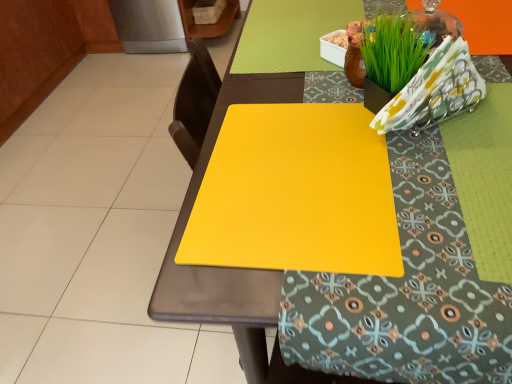
The width and height of the screenshot is (512, 384). Describe the element at coordinates (296, 193) in the screenshot. I see `yellow matte cutting board at center` at that location.

What is the approximate width of yellow matte cutting board at center?

It is 11.36 inches.

The height and width of the screenshot is (384, 512). In order to click on yellow matte cutting board at center in this screenshot , I will do `click(296, 193)`.

Locate an element on the screen. This screenshot has height=384, width=512. yellow matte placemat at center is located at coordinates (233, 268).

In order to face yellow matte placemat at center, should I rotate leftwards or rightwards?

Turn right by 16.352 degrees to look at yellow matte placemat at center.

What do you see at coordinates (233, 268) in the screenshot?
I see `yellow matte placemat at center` at bounding box center [233, 268].

Measure the distance between point (x=258, y=289) and camera.

Point (x=258, y=289) and camera are 19.29 inches apart from each other.

Image resolution: width=512 pixels, height=384 pixels. I want to click on yellow matte cutting board at center, so click(x=296, y=193).

Does yellow matte placemat at center appear on the right side of yellow matte cutting board at center?

Yes.

Which is behind, yellow matte placemat at center or yellow matte cutting board at center?

yellow matte cutting board at center.

Which is in front, point (184, 306) or point (243, 226)?

Point (184, 306)

From the image's perspective, is yellow matte placemat at center positioned above or below yellow matte cutting board at center?

Clearly, from the image's perspective, yellow matte placemat at center is below yellow matte cutting board at center.

From a real-world perspective, between yellow matte placemat at center and yellow matte cutting board at center, who is vertically lower?

In real-world perspective, yellow matte placemat at center is lower.

Which object is wider, yellow matte placemat at center or yellow matte cutting board at center?

yellow matte placemat at center is wider.

Can you confirm if yellow matte placemat at center is taller than yellow matte cutting board at center?

Yes.

Considering the sizes of objects yellow matte placemat at center and yellow matte cutting board at center in the image provided, who is bigger, yellow matte placemat at center or yellow matte cutting board at center?

yellow matte placemat at center.

Based on the photo, can yellow matte cutting board at center be found inside yellow matte placemat at center?

Yes, yellow matte cutting board at center is inside yellow matte placemat at center.

Is yellow matte placemat at center next to yellow matte cutting board at center and touching it?

No, yellow matte placemat at center is not touching yellow matte cutting board at center.

Is yellow matte placemat at center facing away from yellow matte cutting board at center?

yellow matte placemat at center does not have its back to yellow matte cutting board at center.

The height and width of the screenshot is (384, 512). I want to click on table on the right of the yellow matte cutting board at center, so click(233, 268).

Does yellow matte cutting board at center appear on the right side of yellow matte placemat at center?

In fact, yellow matte cutting board at center is to the left of yellow matte placemat at center.

Between yellow matte cutting board at center and yellow matte placemat at center, which one is positioned in front?

yellow matte placemat at center is more forward.

Which is behind, point (244, 173) or point (224, 320)?

Positioned behind is point (244, 173).

From the image's perspective, which one is positioned lower, yellow matte cutting board at center or yellow matte placemat at center?

From the image's view, yellow matte placemat at center is below.

From a real-world perspective, which object stands above the other?

From a 3D spatial view, yellow matte cutting board at center is above.

Considering the sizes of objects yellow matte cutting board at center and yellow matte placemat at center in the image provided, who is thinner, yellow matte cutting board at center or yellow matte placemat at center?

yellow matte cutting board at center.

Who is shorter, yellow matte cutting board at center or yellow matte placemat at center?

yellow matte cutting board at center is shorter.

Consider the image. Based on their sizes in the image, would you say yellow matte cutting board at center is bigger or smaller than yellow matte placemat at center?

In the image, yellow matte cutting board at center appears to be smaller than yellow matte placemat at center.

Is yellow matte cutting board at center inside the boundaries of yellow matte placemat at center, or outside?

yellow matte cutting board at center fits inside yellow matte placemat at center.

Is yellow matte cutting board at center far from yellow matte placemat at center?

Actually, yellow matte cutting board at center and yellow matte placemat at center are a little close together.

Is yellow matte cutting board at center turned away from yellow matte placemat at center?

Yes.

The height and width of the screenshot is (384, 512). What are the coordinates of `sheet behind the yellow matte placemat at center` in the screenshot? It's located at point(296,193).

Where is `sheet that is behind the yellow matte placemat at center`? sheet that is behind the yellow matte placemat at center is located at coordinates (296, 193).

Where is `sheet above the yellow matte placemat at center (from the image's perspective)`? This screenshot has width=512, height=384. sheet above the yellow matte placemat at center (from the image's perspective) is located at coordinates (296, 193).